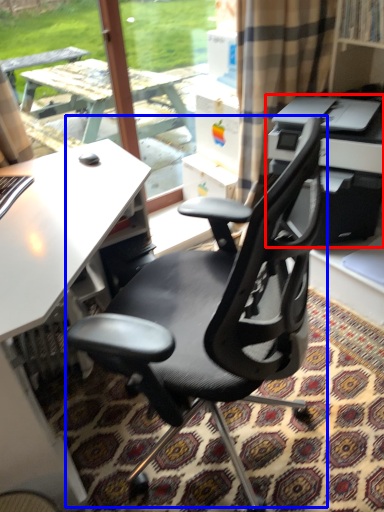
Question: Among these objects, which one is farthest to the camera, printer (highlighted by a red box) or chair (highlighted by a blue box)?

Choices:
 (A) printer
 (B) chair

Answer: (A)